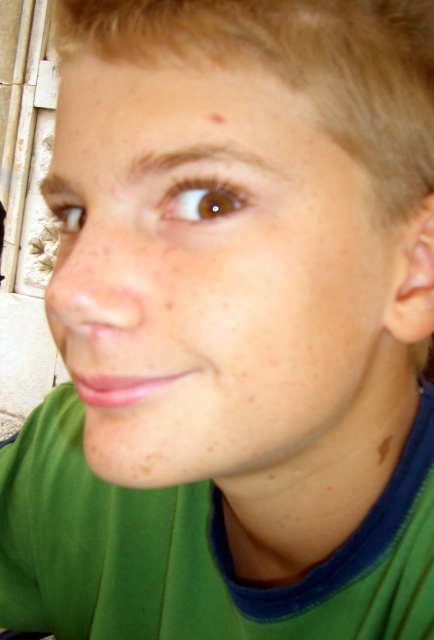
Does smooth skin face at center appear on the left side of brown matte freckle at upper center?

Incorrect, smooth skin face at center is not on the left side of brown matte freckle at upper center.

Is smooth skin face at center bigger than brown matte freckle at upper center?

Yes.

Between point (81, 348) and point (219, 118), which one is positioned behind?

The point (81, 348) is behind.

You are a GUI agent. You are given a task and a screenshot of the screen. Output one action in this format:
    pyautogui.click(x=<x>, y=<y>)
    Task: Click on the smooth skin face at center
    The width and height of the screenshot is (434, 640).
    Given the screenshot: What is the action you would take?
    pyautogui.click(x=217, y=284)

Does brown matte freckle at lower right appear on the left side of brown matte freckle at upper center?

In fact, brown matte freckle at lower right is to the right of brown matte freckle at upper center.

You are a GUI agent. You are given a task and a screenshot of the screen. Output one action in this format:
    pyautogui.click(x=<x>, y=<y>)
    Task: Click on the brown matte freckle at lower right
    Image resolution: width=434 pixels, height=640 pixels.
    Given the screenshot: What is the action you would take?
    coord(384,448)

Can you confirm if smooth skin face at center is shorter than brown matte freckle at lower right?

Incorrect, smooth skin face at center's height does not fall short of brown matte freckle at lower right's.

Between smooth skin face at center and brown matte freckle at lower right, which one appears on the right side from the viewer's perspective?

brown matte freckle at lower right is more to the right.

Which is behind, point (94, 99) or point (382, 444)?

Positioned behind is point (382, 444).

Find the location of `smooth skin face at center`. smooth skin face at center is located at coordinates (217, 284).